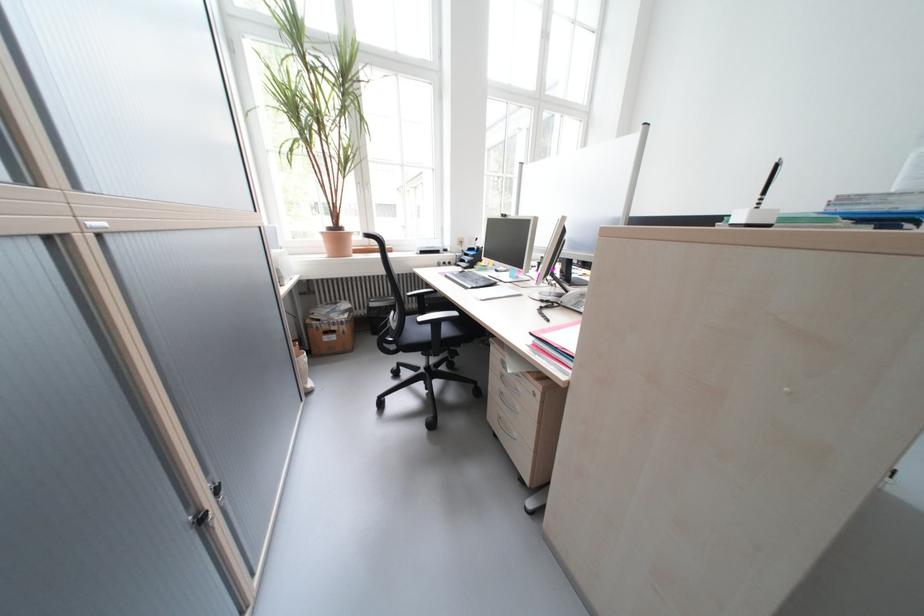
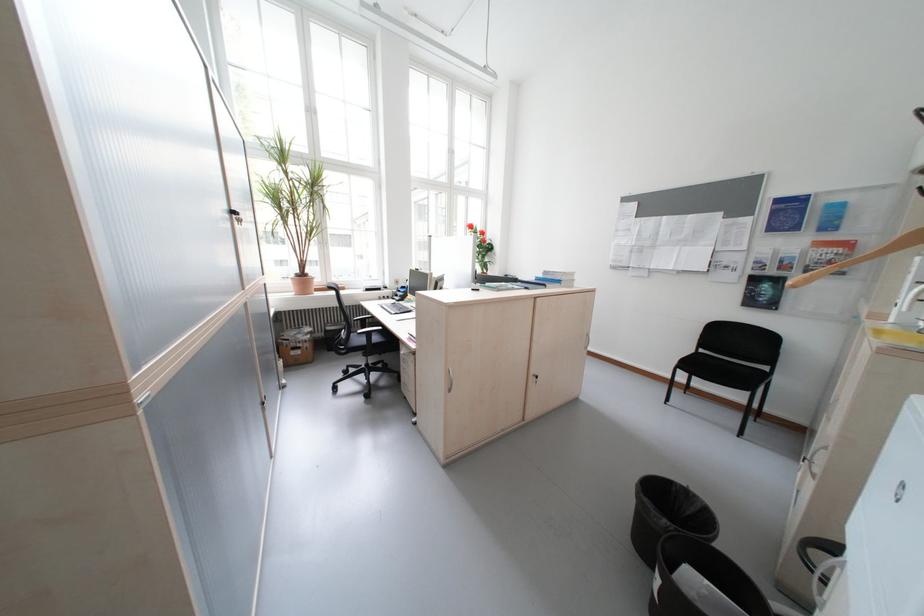
Question: I am providing you with two images of the same scene from different viewpoints. After the viewpoint changes to image2, which objects are now occluded?

Choices:
 (A) chair sitting surface
 (B) silver cabinet handle
 (C) black trash bin
 (D) none of these

Answer: (D)